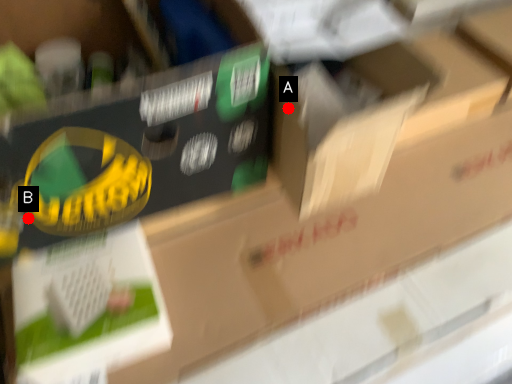
Question: Two points are circled on the image, labeled by A and B beside each circle. Which point is farther to the camera?

Choices:
 (A) A is further
 (B) B is further

Answer: (A)